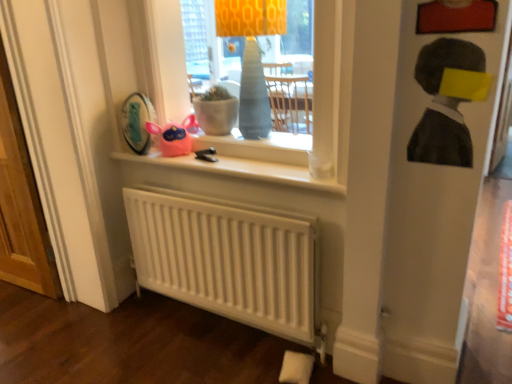
Question: Is matte gray vase at center positioned before white wooden screen door at left?

Choices:
 (A) yes
 (B) no

Answer: (A)

Question: From a real-world perspective, is matte gray vase at center on white wooden screen door at left?

Choices:
 (A) no
 (B) yes

Answer: (B)

Question: Is matte gray vase at center facing towards white wooden screen door at left?

Choices:
 (A) no
 (B) yes

Answer: (A)

Question: Considering the relative positions of matte gray vase at center and white wooden screen door at left in the image provided, is matte gray vase at center to the right of white wooden screen door at left from the viewer's perspective?

Choices:
 (A) no
 (B) yes

Answer: (B)

Question: Is matte gray vase at center further to camera compared to white wooden screen door at left?

Choices:
 (A) no
 (B) yes

Answer: (A)

Question: From the image's perspective, is charcoal sketch portrait at upper right positioned above or below white matte radiator at lower center?

Choices:
 (A) below
 (B) above

Answer: (B)

Question: From their relative heights in the image, would you say charcoal sketch portrait at upper right is taller or shorter than white matte radiator at lower center?

Choices:
 (A) short
 (B) tall

Answer: (A)

Question: Based on their sizes in the image, would you say charcoal sketch portrait at upper right is bigger or smaller than white matte radiator at lower center?

Choices:
 (A) small
 (B) big

Answer: (A)

Question: Is charcoal sketch portrait at upper right to the left or to the right of white matte radiator at lower center in the image?

Choices:
 (A) right
 (B) left

Answer: (A)

Question: Looking at their shapes, would you say white matte window sill at upper center is wider or thinner than matte glass vase at upper center?

Choices:
 (A) thin
 (B) wide

Answer: (A)

Question: Is white matte window sill at upper center to the left or to the right of matte glass vase at upper center in the image?

Choices:
 (A) left
 (B) right

Answer: (A)

Question: Choose the correct answer: Is white matte window sill at upper center inside matte glass vase at upper center or outside it?

Choices:
 (A) outside
 (B) inside

Answer: (A)

Question: Considering the positions of point (320, 180) and point (335, 139), is point (320, 180) closer or farther from the camera than point (335, 139)?

Choices:
 (A) closer
 (B) farther

Answer: (B)

Question: From their relative heights in the image, would you say white matte radiator at lower center is taller or shorter than white matte window sill at upper center?

Choices:
 (A) tall
 (B) short

Answer: (A)

Question: Considering the positions of white matte radiator at lower center and white matte window sill at upper center in the image, is white matte radiator at lower center wider or thinner than white matte window sill at upper center?

Choices:
 (A) wide
 (B) thin

Answer: (B)